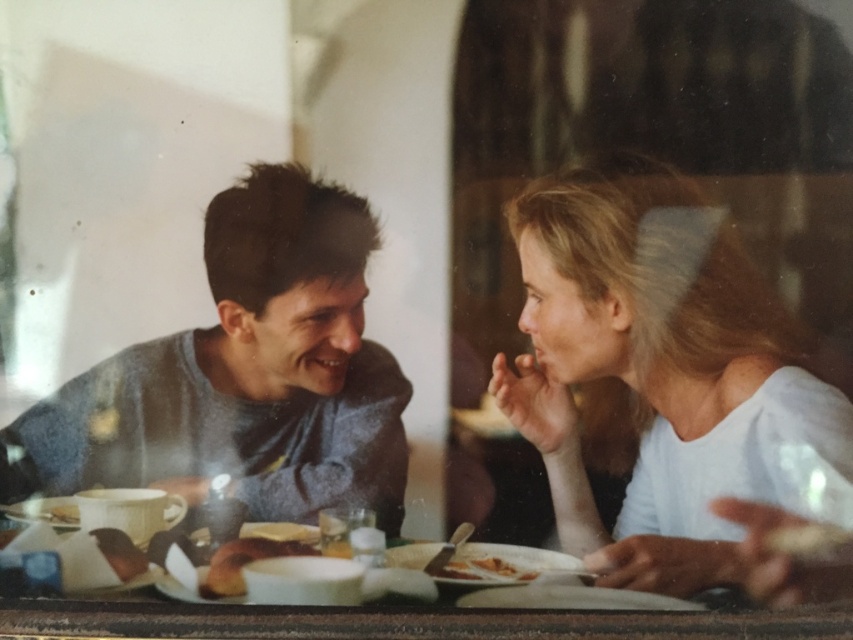
You are a photographer trying to frame a shot of the matte gray sweater at center and the golden crispy pastry at lower center. If you want to ensure both objects are visible in the frame, which object should you position closer to the camera to avoid cropping?

The matte gray sweater at center is wider than the golden crispy pastry at lower center, so positioning the matte gray sweater at center closer to the camera will ensure its full visibility while still fitting the smaller pastry in the frame.

You are sitting at the table in the image. You notice two points marked on the table surface. The first point is located at coordinates point (791, 381) and the second at point (492, 561). If you were to draw a straight line from your current position towards each point, which point would require you to look further away from yourself?

Point (492, 561) is further away from you than point (791, 381), so drawing a line to point (492, 561) would require looking further away.

You are sitting at a table in a cafe and want to place a small vase between the two points labeled point (x=271, y=289) and point (x=248, y=298). Which point should the vase be closer to in order to be placed in front of both?

The vase should be placed closer to point (x=248, y=298) because point (x=271, y=289) is in front of point (x=248, y=298). Therefore, positioning the vase near the rear point ensures it is in front of both.